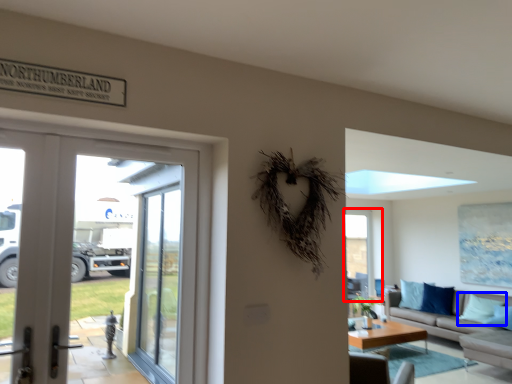
Question: Which object is further to the camera taking this photo, window (highlighted by a red box) or pillow (highlighted by a blue box)?

Choices:
 (A) window
 (B) pillow

Answer: (A)